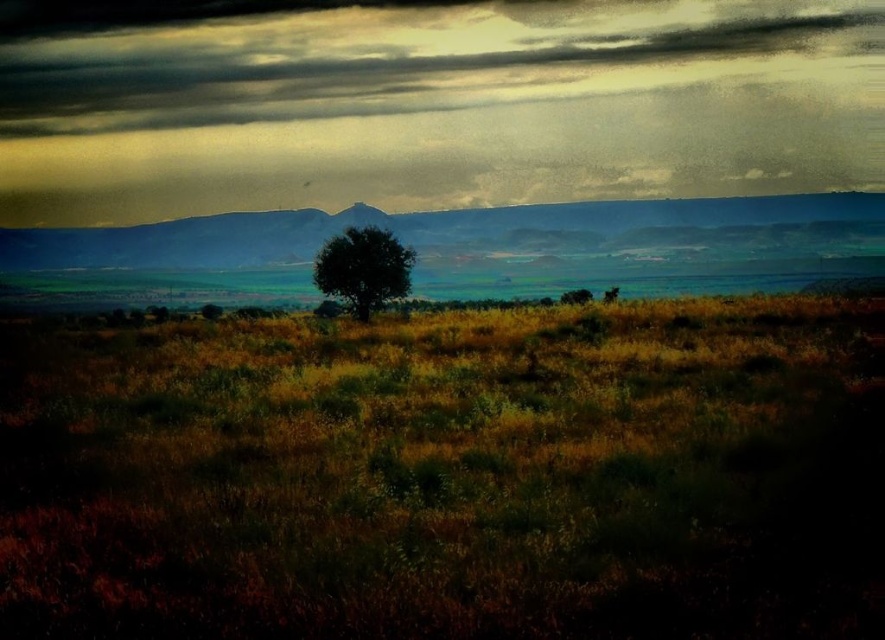
Is green leafy tree at center in front of green matte tree at center?

That is True.

Which is more to the right, green leafy tree at center or green matte tree at center?

green matte tree at center

Does point (389, 256) lie in front of point (566, 291)?

Yes, it is in front of point (566, 291).

I want to click on green leafy tree at center, so click(363, 268).

Can you confirm if cloudy textured sky at upper center is smaller than green leafy tree at center?

Actually, cloudy textured sky at upper center might be larger than green leafy tree at center.

Can you confirm if cloudy textured sky at upper center is positioned to the left of green leafy tree at center?

Incorrect, cloudy textured sky at upper center is not on the left side of green leafy tree at center.

In the scene shown: Who is more distant from viewer, (x=318, y=106) or (x=386, y=278)?

The point (x=318, y=106) is more distant.

The height and width of the screenshot is (640, 885). What are the coordinates of `cloudy textured sky at upper center` in the screenshot? It's located at (391, 54).

Which is below, cloudy textured sky at upper center or dull blue mountain at center?

dull blue mountain at center is below.

The height and width of the screenshot is (640, 885). Describe the element at coordinates (391, 54) in the screenshot. I see `cloudy textured sky at upper center` at that location.

The width and height of the screenshot is (885, 640). In order to click on cloudy textured sky at upper center in this screenshot , I will do `click(391, 54)`.